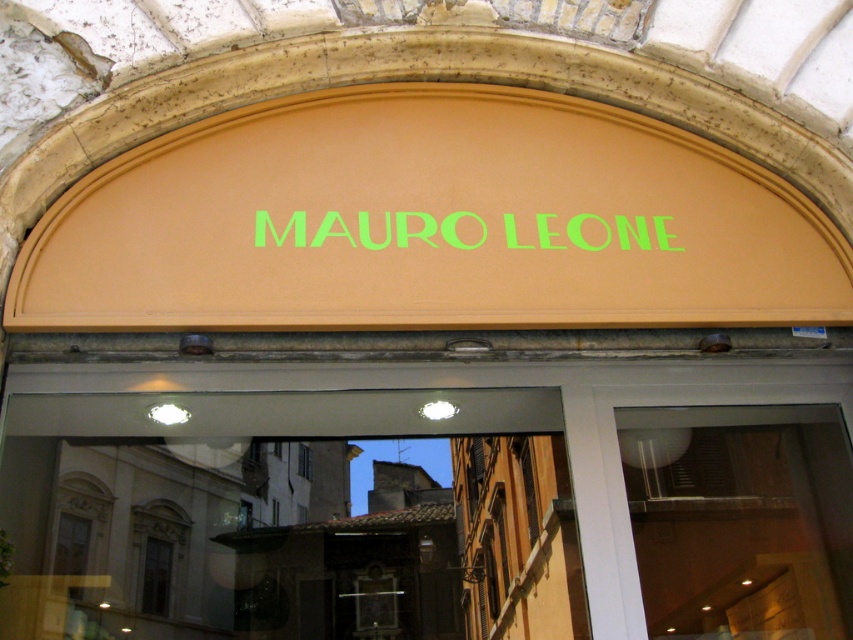
Question: Is transparent glass door at center above green matte sign at center?

Choices:
 (A) yes
 (B) no

Answer: (B)

Question: Does transparent glass door at center lie behind green matte sign at center?

Choices:
 (A) yes
 (B) no

Answer: (A)

Question: Which object is closer to the camera taking this photo?

Choices:
 (A) transparent glass door at center
 (B) green matte sign at center

Answer: (B)

Question: Observing the image, what is the correct spatial positioning of transparent glass door at center in reference to green matte sign at center?

Choices:
 (A) right
 (B) left

Answer: (A)